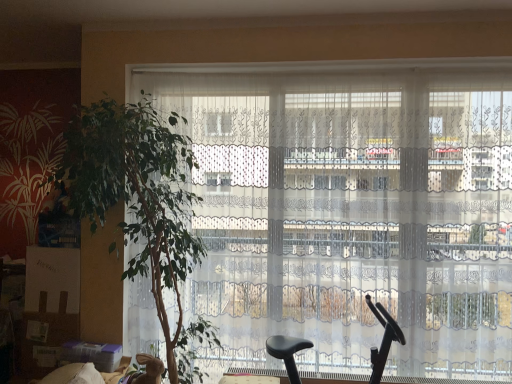
Question: Should I look upward or downward to see green leafy plant at left?

Choices:
 (A) up
 (B) down

Answer: (B)

Question: From the image's perspective, is green leafy plant at left beneath black plastic baby carriage at center?

Choices:
 (A) yes
 (B) no

Answer: (B)

Question: From a real-world perspective, is green leafy plant at left physically below black plastic baby carriage at center?

Choices:
 (A) no
 (B) yes

Answer: (A)

Question: Can you confirm if green leafy plant at left is positioned to the right of black plastic baby carriage at center?

Choices:
 (A) no
 (B) yes

Answer: (A)

Question: Are green leafy plant at left and black plastic baby carriage at center far apart?

Choices:
 (A) yes
 (B) no

Answer: (A)

Question: Is green leafy plant at left smaller than black plastic baby carriage at center?

Choices:
 (A) yes
 (B) no

Answer: (B)

Question: Does green leafy plant at left lie behind black plastic baby carriage at center?

Choices:
 (A) no
 (B) yes

Answer: (A)

Question: Is black plastic baby carriage at center not inside white lace curtains at center?

Choices:
 (A) no
 (B) yes

Answer: (B)

Question: Is black plastic baby carriage at center far from white lace curtains at center?

Choices:
 (A) no
 (B) yes

Answer: (A)

Question: Is white lace curtains at center a part of black plastic baby carriage at center?

Choices:
 (A) no
 (B) yes

Answer: (A)

Question: Is black plastic baby carriage at center at the right side of white lace curtains at center?

Choices:
 (A) yes
 (B) no

Answer: (A)

Question: Is black plastic baby carriage at center bigger than white lace curtains at center?

Choices:
 (A) no
 (B) yes

Answer: (A)

Question: From a real-world perspective, is black plastic baby carriage at center physically above white lace curtains at center?

Choices:
 (A) no
 (B) yes

Answer: (A)

Question: Is white lace curtains at center positioned behind green leafy plant at left?

Choices:
 (A) yes
 (B) no

Answer: (A)